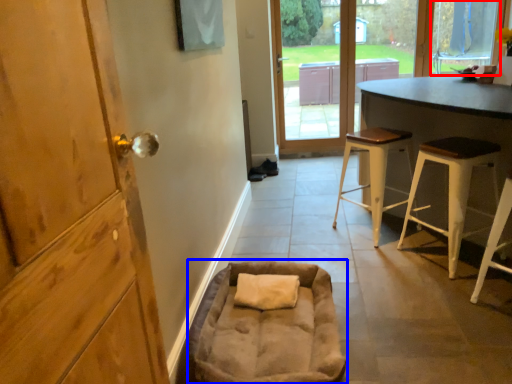
Question: Which object is further to the camera taking this photo, window (highlighted by a red box) or bean bag chair (highlighted by a blue box)?

Choices:
 (A) window
 (B) bean bag chair

Answer: (A)